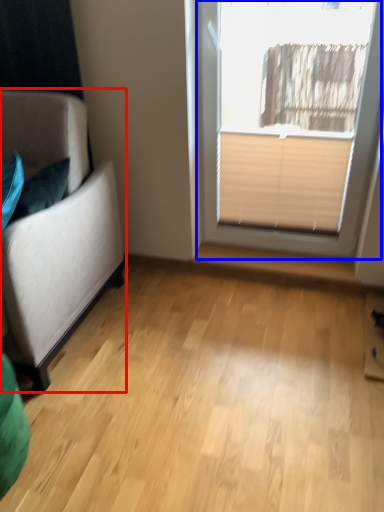
Question: Among these objects, which one is farthest to the camera, studio couch (highlighted by a red box) or window (highlighted by a blue box)?

Choices:
 (A) studio couch
 (B) window

Answer: (B)